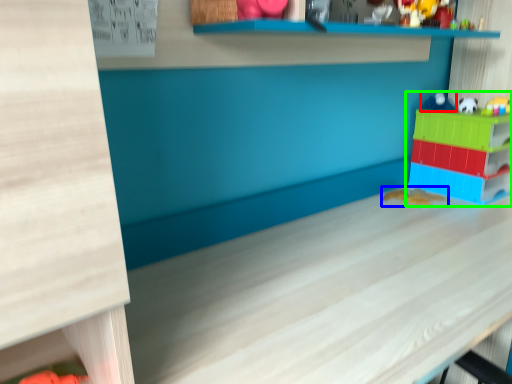
Question: Based on their relative distances, which object is farther from toy (highlighted by a red box)? Choose from toy (highlighted by a blue box) and toy (highlighted by a green box).

Choices:
 (A) toy
 (B) toy

Answer: (A)